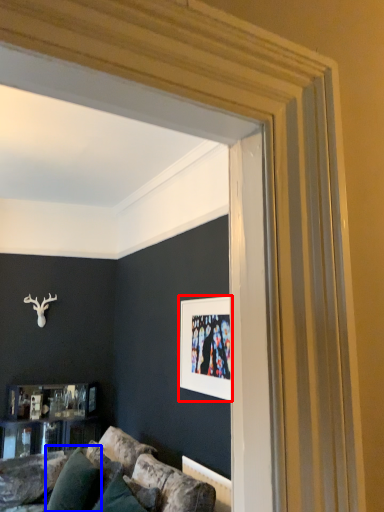
Question: Which of the following is the closest to the observer, picture frame (highlighted by a red box) or pillow (highlighted by a blue box)?

Choices:
 (A) picture frame
 (B) pillow

Answer: (A)